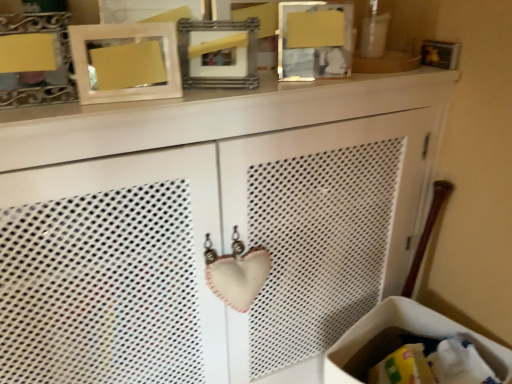
Locate an element on the screen. Image resolution: width=512 pixels, height=384 pixels. vacant space in front of wooden picture frame at upper center, the 1th picture frame positioned from the right is located at coordinates (296, 83).